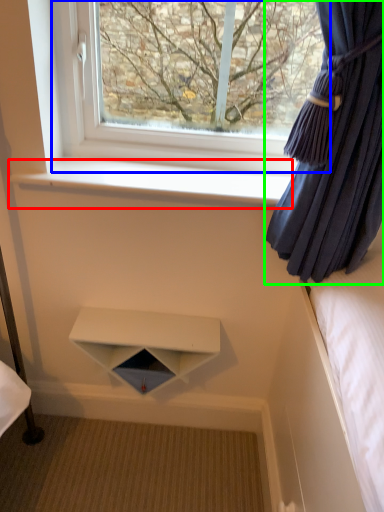
Question: Which object is the farthest from window sill (highlighted by a red box)? Choose among these: window (highlighted by a blue box) or curtain (highlighted by a green box).

Choices:
 (A) window
 (B) curtain

Answer: (B)